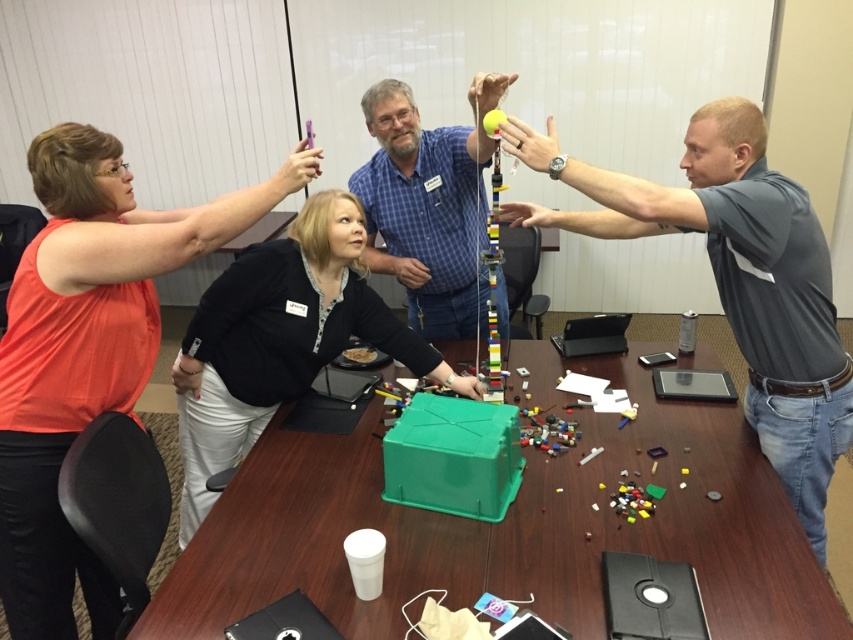
Question: Is gray fabric shirt at right smaller than blue plaid shirt at center?

Choices:
 (A) yes
 (B) no

Answer: (B)

Question: Considering the real-world distances, which object is closest to the blue plaid shirt at center?

Choices:
 (A) green plastic table at center
 (B) matte orange shirt at upper left
 (C) black matte jacket at center

Answer: (C)

Question: Among these objects, which one is nearest to the camera?

Choices:
 (A) matte orange shirt at upper left
 (B) green plastic table at center

Answer: (B)

Question: Estimate the real-world distances between objects in this image. Which object is farther from the gray fabric shirt at right?

Choices:
 (A) green plastic table at center
 (B) blue plaid shirt at center
 (C) black matte jacket at center

Answer: (C)

Question: Does gray fabric shirt at right have a greater width compared to blue plaid shirt at center?

Choices:
 (A) no
 (B) yes

Answer: (B)

Question: Can you confirm if matte orange shirt at upper left is smaller than black matte jacket at center?

Choices:
 (A) no
 (B) yes

Answer: (B)